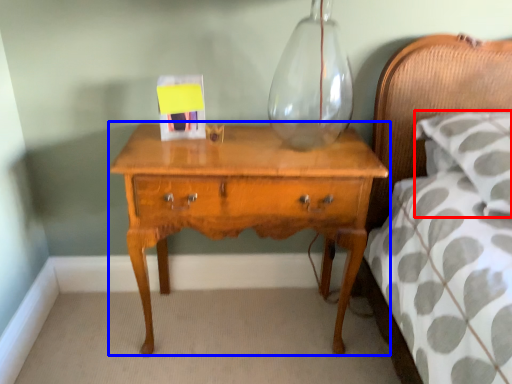
Question: Which object appears farthest to the camera in this image, pillow (highlighted by a red box) or nightstand (highlighted by a blue box)?

Choices:
 (A) pillow
 (B) nightstand

Answer: (B)